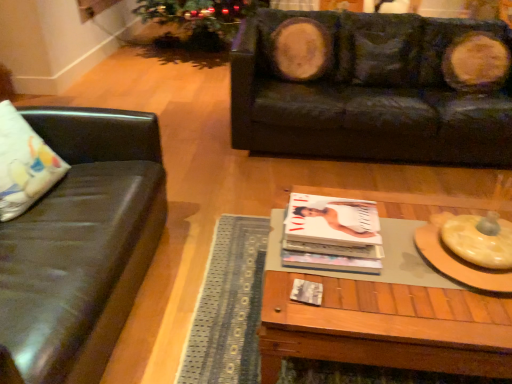
Question: Considering the relative sizes of black leather couch at upper right, placed as the second studio couch when sorted from left to right, and woodenwoodencoffee table at center in the image provided, is black leather couch at upper right, placed as the second studio couch when sorted from left to right, thinner than woodenwoodencoffee table at center?

Choices:
 (A) yes
 (B) no

Answer: (B)

Question: Is black leather couch at upper right, arranged as the first studio couch when viewed from the right, not inside woodenwoodencoffee table at center?

Choices:
 (A) no
 (B) yes

Answer: (B)

Question: From the image's perspective, is black leather couch at upper right, which appears as the first studio couch when viewed from the back, on woodenwoodencoffee table at center?

Choices:
 (A) no
 (B) yes

Answer: (B)

Question: Can you confirm if black leather couch at upper right, arranged as the first studio couch when viewed from the right, is shorter than woodenwoodencoffee table at center?

Choices:
 (A) yes
 (B) no

Answer: (B)

Question: Visually, is woodenwoodencoffee table at center positioned to the left or to the right of matte black couch at left, which is the 2th studio couch in back-to-front order?

Choices:
 (A) right
 (B) left

Answer: (A)

Question: In the image, is woodenwoodencoffee table at center positioned in front of or behind matte black couch at left, which is the 2th studio couch in back-to-front order?

Choices:
 (A) front
 (B) behind

Answer: (B)

Question: Which is correct: woodenwoodencoffee table at center is inside matte black couch at left, the second studio couch positioned from the right, or outside of it?

Choices:
 (A) outside
 (B) inside

Answer: (A)

Question: From a real-world perspective, is woodenwoodencoffee table at center above or below matte black couch at left, the second studio couch positioned from the right?

Choices:
 (A) above
 (B) below

Answer: (B)

Question: Based on their sizes in the image, would you say white fabric pillow at left is bigger or smaller than matte black couch at left, arranged as the 1th studio couch when viewed from the left?

Choices:
 (A) small
 (B) big

Answer: (A)

Question: In the image, is white fabric pillow at left positioned in front of or behind matte black couch at left, which is the 2th studio couch in back-to-front order?

Choices:
 (A) behind
 (B) front

Answer: (A)

Question: From a real-world perspective, relative to matte black couch at left, arranged as the 1th studio couch when viewed from the left, is white fabric pillow at left vertically above or below?

Choices:
 (A) below
 (B) above

Answer: (B)

Question: Is white fabric pillow at left to the left or to the right of matte black couch at left, arranged as the 1th studio couch when viewed from the left, in the image?

Choices:
 (A) right
 (B) left

Answer: (B)

Question: From their relative heights in the image, would you say black leather couch at upper right, placed as the second studio couch when sorted from left to right, is taller or shorter than matte white magazine at center?

Choices:
 (A) tall
 (B) short

Answer: (A)

Question: From the image's perspective, is black leather couch at upper right, arranged as the first studio couch when viewed from the right, located above or below matte white magazine at center?

Choices:
 (A) above
 (B) below

Answer: (A)